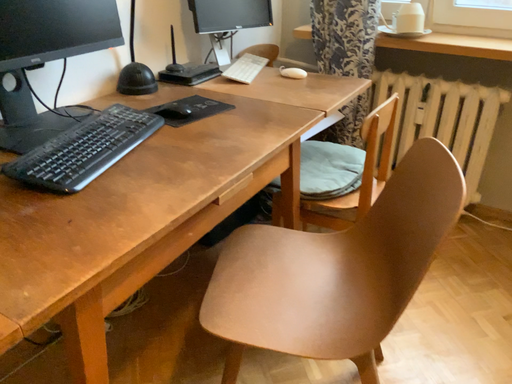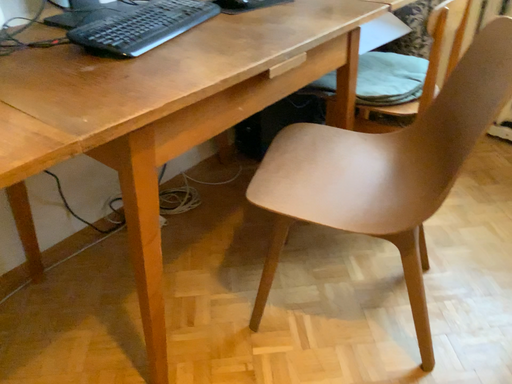
Question: How did the camera likely rotate when shooting the video?

Choices:
 (A) rotated left
 (B) rotated right

Answer: (A)